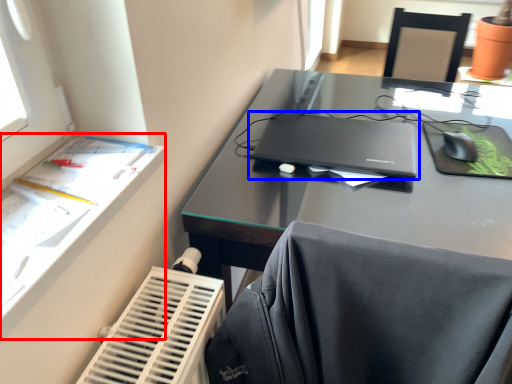
Question: Among these objects, which one is farthest to the camera, writing desk (highlighted by a red box) or laptop (highlighted by a blue box)?

Choices:
 (A) writing desk
 (B) laptop

Answer: (B)